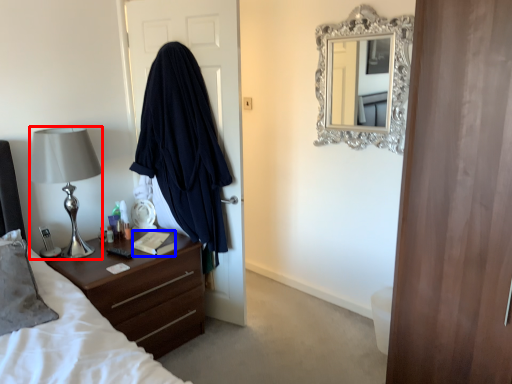
Question: Among these objects, which one is nearest to the camera, lamp (highlighted by a red box) or book (highlighted by a blue box)?

Choices:
 (A) lamp
 (B) book

Answer: (A)